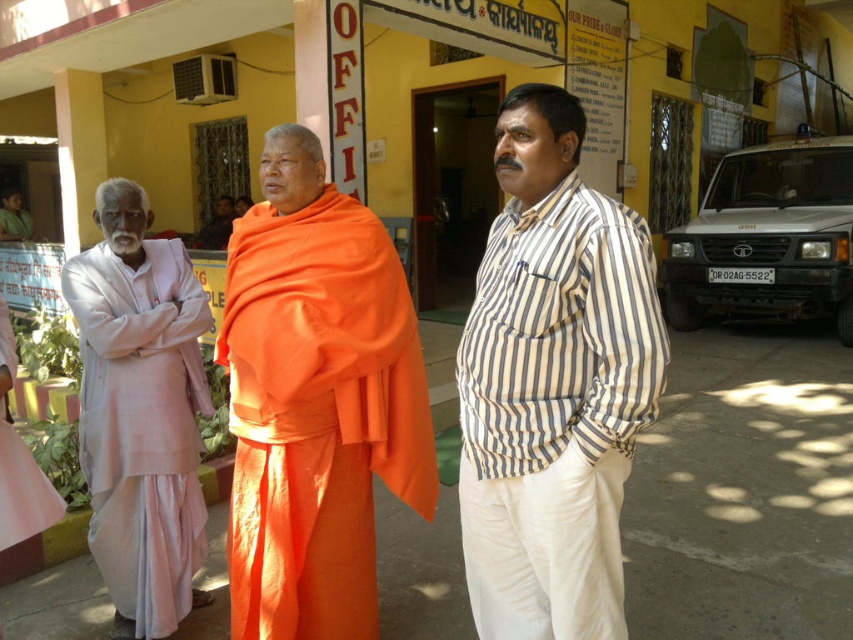
You are a tailor who needs to determine which garment requires more fabric to alter. Based on the scene, which garment between the striped cotton shirt at center and the light pink cotton kurta at left needs more fabric for alterations?

The striped cotton shirt at center has a larger size compared to the light pink cotton kurta at left, so it would require more fabric for alterations.

You are a photographer trying to capture a clear shot of the light pink cotton kurta at left without the orange cloth at center blocking it. How should you adjust your position?

Move to the right side so that the orange cloth at center is no longer covering the light pink cotton kurta at left.

You are a photographer trying to capture a group photo of the striped cotton shirt at center and orange cloth at center. Which clothing item will appear narrower in the photo?

The striped cotton shirt at center will appear narrower in the photo because its width is less than the orange cloth at center.